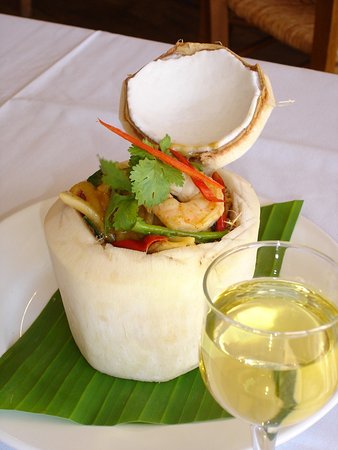
You are a GUI agent. You are given a task and a screenshot of the screen. Output one action in this format:
    pyautogui.click(x=<x>, y=<y>)
    Task: Click on the tablecloth
    This screenshot has width=338, height=450.
    Given the screenshot: What is the action you would take?
    pyautogui.click(x=65, y=154)